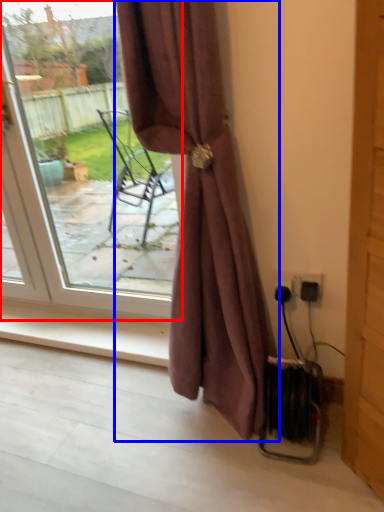
Question: Which object is closer to the camera taking this photo, door (highlighted by a red box) or curtain (highlighted by a blue box)?

Choices:
 (A) door
 (B) curtain

Answer: (B)